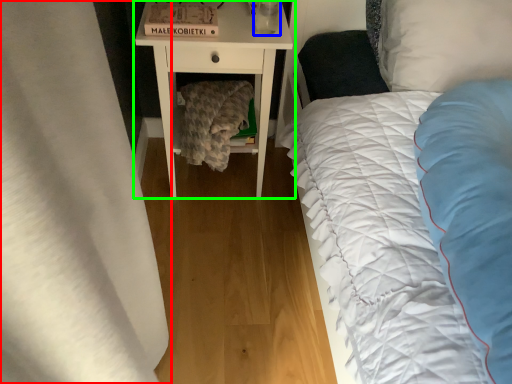
Question: Based on their relative distances, which object is farther from curtain (highlighted by a red box)? Choose from glass vase (highlighted by a blue box) and nightstand (highlighted by a green box).

Choices:
 (A) glass vase
 (B) nightstand

Answer: (A)